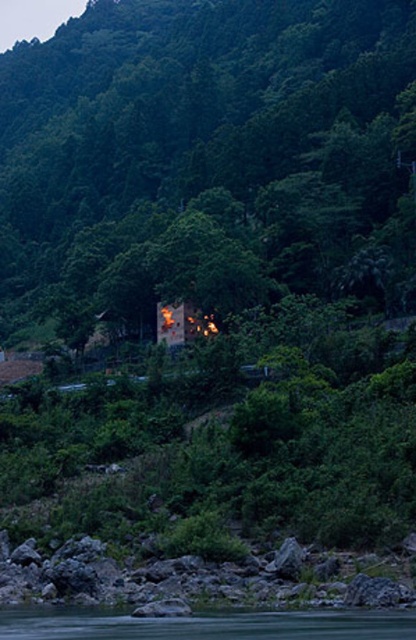
Question: Which of the following is the closest to the observer?

Choices:
 (A) green smooth water at lower center
 (B) green leafy tree at center

Answer: (A)

Question: Can you confirm if green leafy tree at center is positioned above green smooth water at lower center?

Choices:
 (A) yes
 (B) no

Answer: (A)

Question: Does green leafy tree at center appear under green smooth water at lower center?

Choices:
 (A) yes
 (B) no

Answer: (B)

Question: Which object is closer to the camera taking this photo?

Choices:
 (A) green smooth water at lower center
 (B) green leafy tree at center

Answer: (A)

Question: Does green leafy tree at center come behind green smooth water at lower center?

Choices:
 (A) yes
 (B) no

Answer: (A)